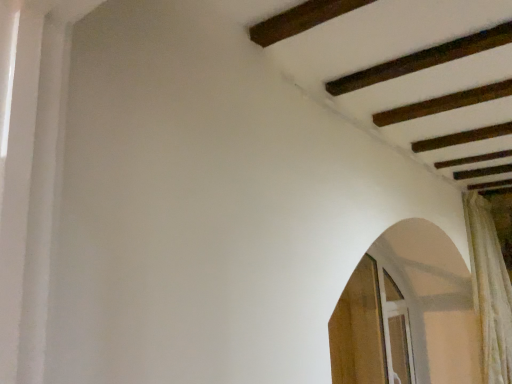
Question: Could wooden screen door at lower right, the second screen door viewed from the right, be considered to be inside clear glass screen door at lower right, which is counted as the first screen door, starting from the right?

Choices:
 (A) no
 (B) yes

Answer: (A)

Question: Is clear glass screen door at lower right, which ranks as the 2th screen door in left-to-right order, to the left of wooden screen door at lower right, positioned as the first screen door in left-to-right order, from the viewer's perspective?

Choices:
 (A) yes
 (B) no

Answer: (B)

Question: Is clear glass screen door at lower right, which is counted as the first screen door, starting from the right, thinner than wooden screen door at lower right, positioned as the first screen door in left-to-right order?

Choices:
 (A) no
 (B) yes

Answer: (A)

Question: From a real-world perspective, is clear glass screen door at lower right, which is counted as the first screen door, starting from the right, on top of wooden screen door at lower right, the second screen door viewed from the right?

Choices:
 (A) no
 (B) yes

Answer: (A)

Question: Considering the relative sizes of clear glass screen door at lower right, which is counted as the first screen door, starting from the right, and wooden screen door at lower right, positioned as the first screen door in left-to-right order, in the image provided, is clear glass screen door at lower right, which is counted as the first screen door, starting from the right, taller than wooden screen door at lower right, positioned as the first screen door in left-to-right order,?

Choices:
 (A) no
 (B) yes

Answer: (A)

Question: Is clear glass screen door at lower right, which ranks as the 2th screen door in left-to-right order, positioned in front of wooden screen door at lower right, positioned as the first screen door in left-to-right order?

Choices:
 (A) no
 (B) yes

Answer: (A)

Question: Is white textured curtain at right positioned far away from clear glass screen door at lower right, which ranks as the 2th screen door in left-to-right order?

Choices:
 (A) no
 (B) yes

Answer: (A)

Question: Considering the relative positions of white textured curtain at right and clear glass screen door at lower right, which is counted as the first screen door, starting from the right, in the image provided, is white textured curtain at right to the right of clear glass screen door at lower right, which is counted as the first screen door, starting from the right, from the viewer's perspective?

Choices:
 (A) no
 (B) yes

Answer: (B)

Question: Is white textured curtain at right behind clear glass screen door at lower right, which is counted as the first screen door, starting from the right?

Choices:
 (A) no
 (B) yes

Answer: (A)

Question: Is white textured curtain at right facing away from clear glass screen door at lower right, which ranks as the 2th screen door in left-to-right order?

Choices:
 (A) yes
 (B) no

Answer: (A)

Question: From the image's perspective, is white textured curtain at right beneath clear glass screen door at lower right, which is counted as the first screen door, starting from the right?

Choices:
 (A) yes
 (B) no

Answer: (B)

Question: From a real-world perspective, is white textured curtain at right on clear glass screen door at lower right, which is counted as the first screen door, starting from the right?

Choices:
 (A) yes
 (B) no

Answer: (A)

Question: Is wooden screen door at lower right, positioned as the first screen door in left-to-right order, not close to white textured curtain at right?

Choices:
 (A) yes
 (B) no

Answer: (B)